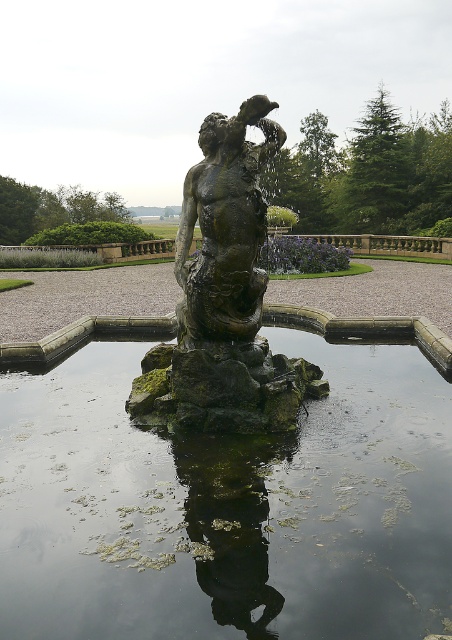
Question: Which point is farther from the camera taking this photo?

Choices:
 (A) [330, 573]
 (B) [189, 237]

Answer: (B)

Question: Does green mossy rock at center appear on the left side of bronze statue at center?

Choices:
 (A) no
 (B) yes

Answer: (B)

Question: Which object is the closest to the bronze statue at center?

Choices:
 (A) green mossy statue at center
 (B) green mossy rock at center

Answer: (A)

Question: Which point appears farthest from the camera in this image?

Choices:
 (A) tap(362, 403)
 (B) tap(133, 412)
 (C) tap(222, 170)

Answer: (A)

Question: Is green mossy statue at center to the right of bronze statue at center from the viewer's perspective?

Choices:
 (A) yes
 (B) no

Answer: (A)

Question: Can you confirm if green mossy statue at center is positioned to the right of bronze statue at center?

Choices:
 (A) yes
 (B) no

Answer: (A)